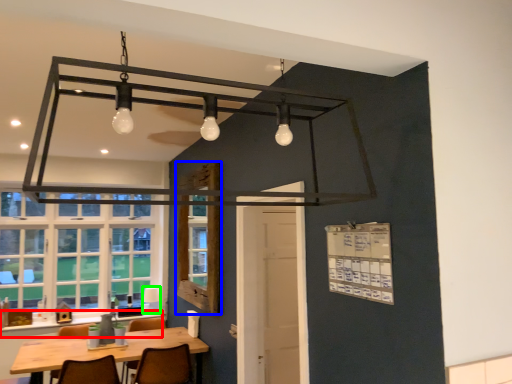
Question: Which object is the closest to the counter top (highlighted by a red box)? Choose among these: window screen (highlighted by a blue box) or lamp (highlighted by a green box).

Choices:
 (A) window screen
 (B) lamp

Answer: (B)